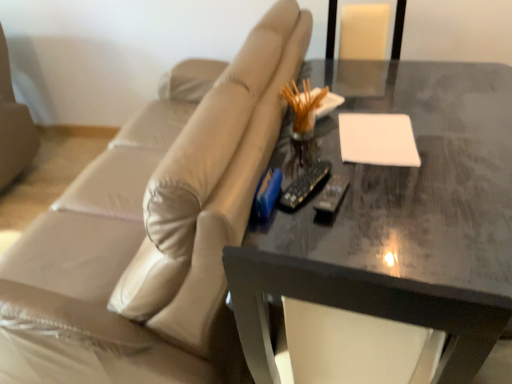
In order to click on vacant area that is in front of black plastic remote at center in this screenshot , I will do `click(327, 231)`.